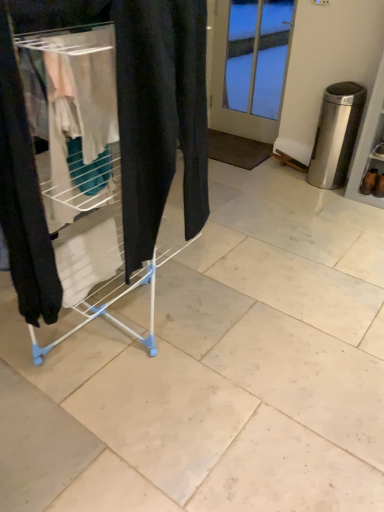
In order to click on vacant space that is in between white plastic drying rack at left and satin silver trash can at right in this screenshot , I will do `click(263, 230)`.